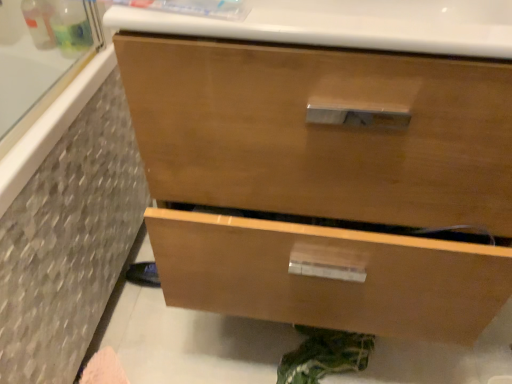
Question: Relative to glossy wood drawer at center, is matte gray tile at left in front or behind?

Choices:
 (A) behind
 (B) front

Answer: (A)

Question: Considering the relative positions of matte gray tile at left and glossy wood drawer at center in the image provided, is matte gray tile at left to the left or to the right of glossy wood drawer at center?

Choices:
 (A) right
 (B) left

Answer: (B)

Question: From the image's perspective, is matte gray tile at left located above or below glossy wood drawer at center?

Choices:
 (A) above
 (B) below

Answer: (B)

Question: Is glossy wood drawer at center bigger or smaller than matte gray tile at left?

Choices:
 (A) small
 (B) big

Answer: (B)

Question: From the image's perspective, is glossy wood drawer at center above or below matte gray tile at left?

Choices:
 (A) below
 (B) above

Answer: (B)

Question: In the image, is glossy wood drawer at center positioned in front of or behind matte gray tile at left?

Choices:
 (A) front
 (B) behind

Answer: (A)

Question: From a real-world perspective, is glossy wood drawer at center positioned above or below matte gray tile at left?

Choices:
 (A) below
 (B) above

Answer: (B)